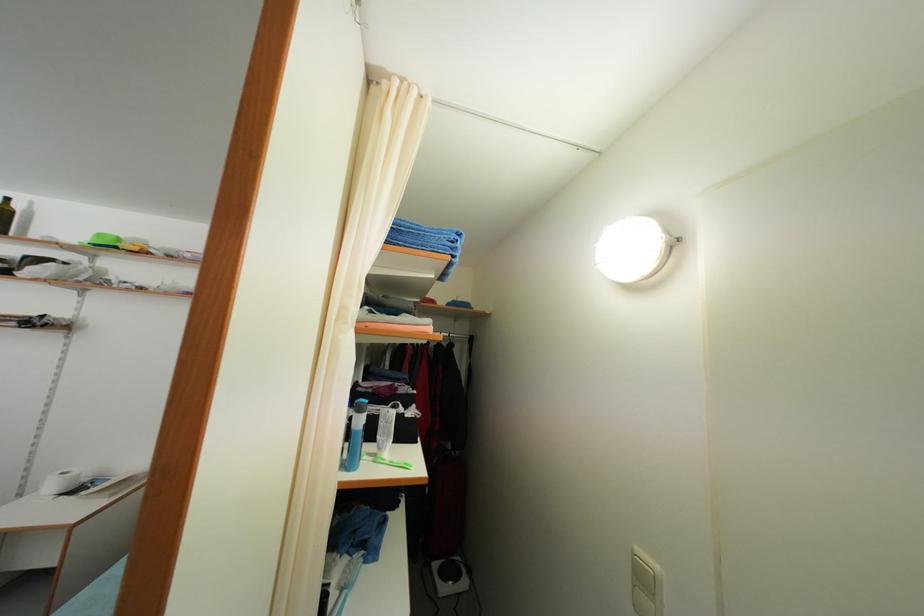
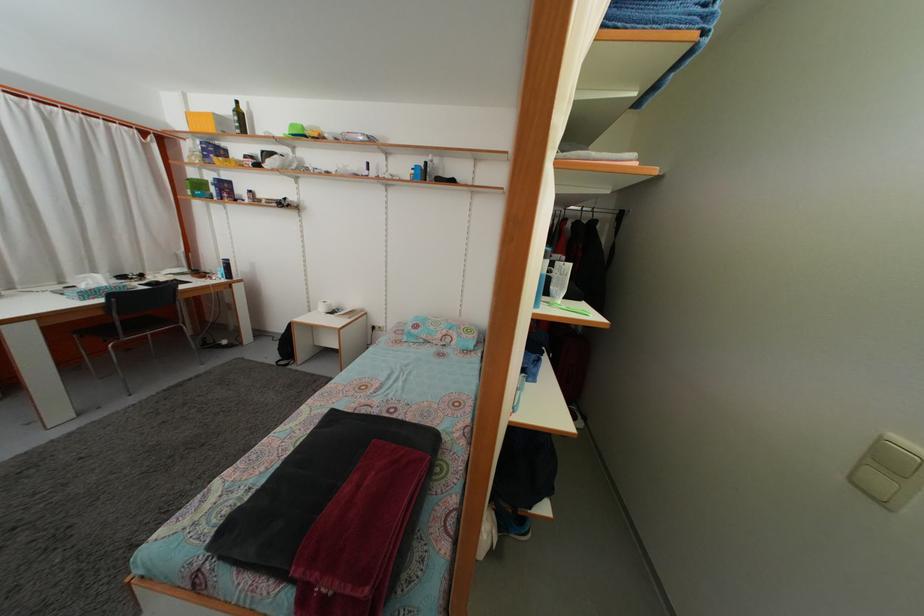
Where in the second image is the point corresponding to point (643, 557) from the first image?

(903, 445)